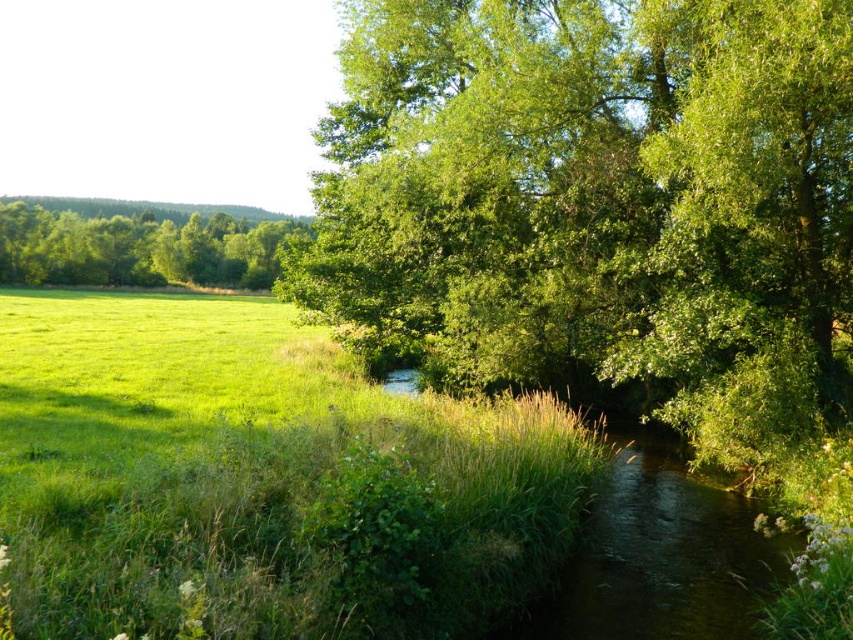
You are a hiker trying to decide which green leafy tree to rest under. You want to choose the one that provides more shade coverage. Which tree should you choose between the green leafy tree at center and the green leafy tree at left?

The green leafy tree at left provides more shade coverage because it has a greater width compared to the green leafy tree at center.

You are standing at the point marked by the coordinates point (604, 214) in the image. What is the nearest object to you?

The nearest object to you is the green leafy tree at center marked by the point (604, 214).

You are standing in the middle of the open grassland and see the green leafy tree at center and the green leafy tree at left. Which tree is closer to your current position?

The green leafy tree at center is closer to your current position because it is positioned on the right side of the green leafy tree at left, meaning it is between you and the tree at left.